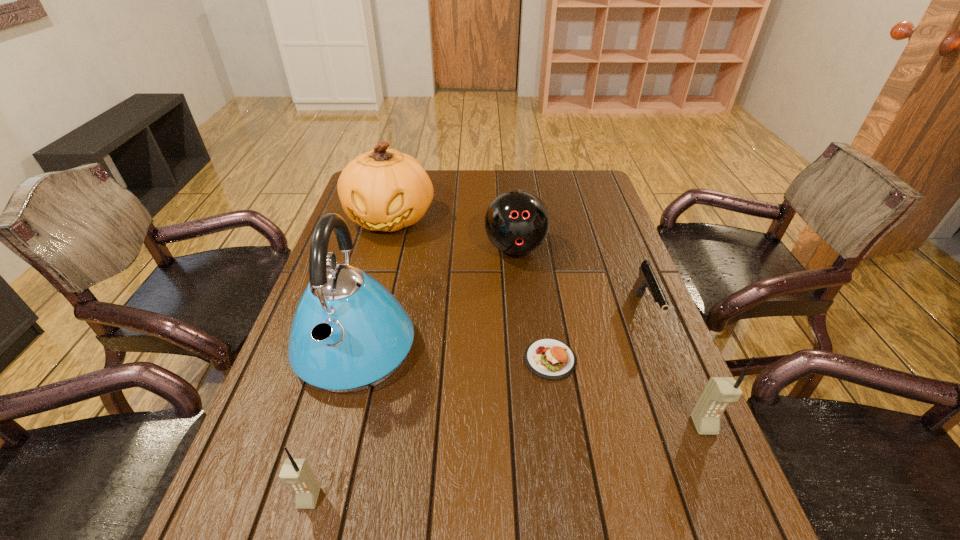
You are a GUI agent. You are given a task and a screenshot of the screen. Output one action in this format:
    pyautogui.click(x=<x>, y=<y>)
    Task: Click on the unoccupied position between the bowling ball and the shorter cellular telephone
    This screenshot has width=960, height=540.
    Given the screenshot: What is the action you would take?
    pyautogui.click(x=412, y=374)

Where is `vacant point located between the right cellular telephone and the second shortest object`? The image size is (960, 540). vacant point located between the right cellular telephone and the second shortest object is located at coordinates (675, 368).

The image size is (960, 540). Find the location of `blank region between the left cellular telephone and the second nearest object`. blank region between the left cellular telephone and the second nearest object is located at coordinates (506, 462).

At what (x,y) coordinates should I click in order to perform the action: click on free space between the right cellular telephone and the shortest object. Please return your answer as a coordinate pair (x, y). Looking at the image, I should click on (627, 392).

The width and height of the screenshot is (960, 540). What are the coordinates of `vacant area between the sixth tallest object and the sixth shortest object` in the screenshot? It's located at (517, 265).

The width and height of the screenshot is (960, 540). I want to click on free spot between the bowling ball and the sixth shortest object, so click(453, 234).

Find the location of a particular element. free space between the bowling ball and the kettle is located at coordinates (436, 298).

The image size is (960, 540). Find the location of `vacant area between the pistol and the shortest object`. vacant area between the pistol and the shortest object is located at coordinates (598, 335).

Identify which object is the second closest to the bowling ball. Please provide its 2D coordinates. Your answer should be formatted as a tuple, i.e. [(x, y)], where the tuple contains the x and y coordinates of a point satisfying the conditions above.

[(349, 333)]

At what (x,y) coordinates should I click in order to perform the action: click on object that ranks as the third closest to the pumpkin. Please return your answer as a coordinate pair (x, y). The width and height of the screenshot is (960, 540). Looking at the image, I should click on (552, 359).